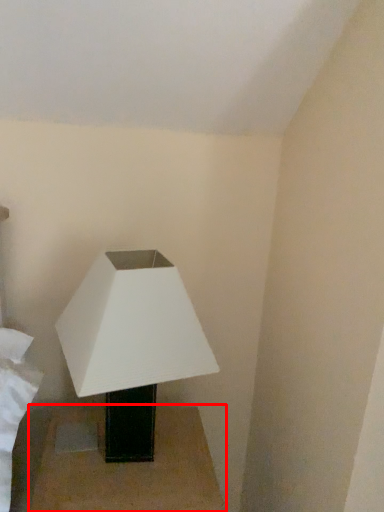
Question: Considering the relative positions of table (annotated by the red box) and lamp in the image provided, where is table (annotated by the red box) located with respect to the staircase?

Choices:
 (A) left
 (B) right

Answer: (A)